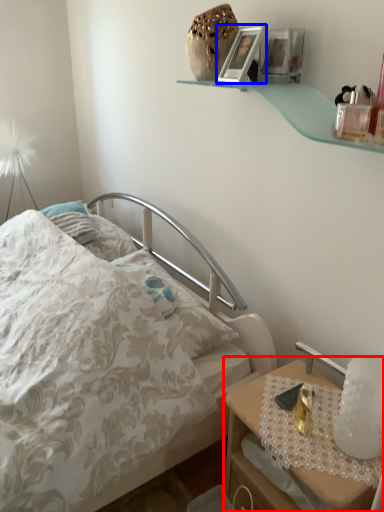
Question: Among these objects, which one is farthest to the camera, nightstand (highlighted by a red box) or picture frame (highlighted by a blue box)?

Choices:
 (A) nightstand
 (B) picture frame

Answer: (B)